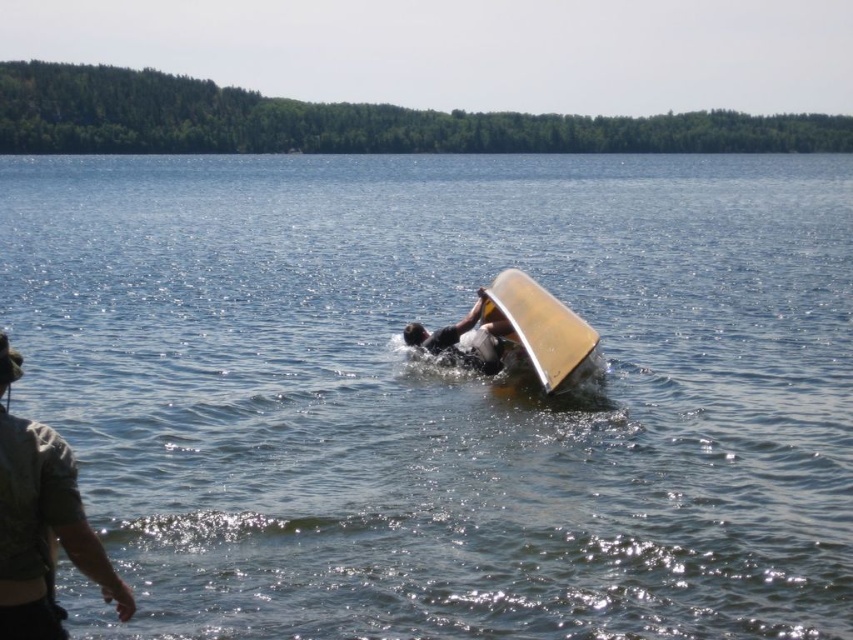
Does transparent plastic surfboard at center appear under dark gray matte surfboard at center?

No.

Between transparent plastic surfboard at center and dark gray matte surfboard at center, which one is positioned higher?

transparent plastic surfboard at center is above.

Which is behind, point (572, 310) or point (498, 371)?

The point (498, 371) is more distant.

I want to click on transparent plastic surfboard at center, so click(x=538, y=326).

Does camouflage fabric shirt at left have a lesser height compared to dark gray matte surfboard at center?

No, camouflage fabric shirt at left is not shorter than dark gray matte surfboard at center.

Is camouflage fabric shirt at left thinner than dark gray matte surfboard at center?

Correct, camouflage fabric shirt at left's width is less than dark gray matte surfboard at center's.

You are a GUI agent. You are given a task and a screenshot of the screen. Output one action in this format:
    pyautogui.click(x=<x>, y=<y>)
    Task: Click on the camouflage fabric shirt at left
    
    Given the screenshot: What is the action you would take?
    pyautogui.click(x=44, y=531)

Does camouflage fabric shirt at left appear under transparent plastic surfboard at center?

Yes.

Is point (6, 637) less distant than point (514, 344)?

Yes, it is in front of point (514, 344).

The height and width of the screenshot is (640, 853). I want to click on camouflage fabric shirt at left, so click(44, 531).